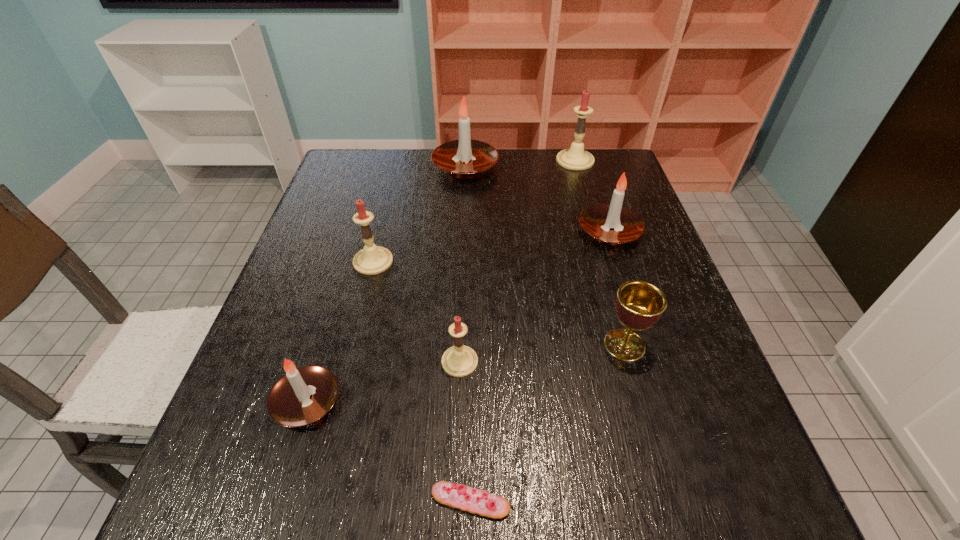
The image size is (960, 540). Find the location of `the nearest white candle`. the nearest white candle is located at coordinates (303, 395).

Locate an element on the screen. The width and height of the screenshot is (960, 540). the second red candle from right to left is located at coordinates (459, 360).

I want to click on the nearest red candle, so click(459, 360).

This screenshot has height=540, width=960. Find the location of `the shortest object`. the shortest object is located at coordinates (477, 501).

You are a GUI agent. You are given a task and a screenshot of the screen. Output one action in this format:
    pyautogui.click(x=<x>, y=<y>)
    Task: Click on the nearest object
    The image size is (960, 540).
    Given the screenshot: What is the action you would take?
    pyautogui.click(x=477, y=501)

Find the location of a particular element. This screenshot has width=960, height=540. free location located 0.170m on the left of the second white candle from right to left is located at coordinates (378, 167).

Find the location of `free space located 0.100m on the front of the farthest red candle`. free space located 0.100m on the front of the farthest red candle is located at coordinates (584, 189).

This screenshot has height=540, width=960. Find the location of `free space located on the front of the second biggest white candle`. free space located on the front of the second biggest white candle is located at coordinates pos(632,300).

Locate an element on the screen. The height and width of the screenshot is (540, 960). vacant space located 0.160m on the front of the second nearest red candle is located at coordinates (356, 329).

Identify the location of free point located 0.070m on the right of the chalice. (681, 345).